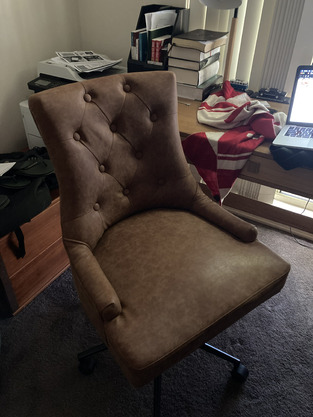
Find the location of a particular element. The width and height of the screenshot is (313, 417). table is located at coordinates (194, 116).